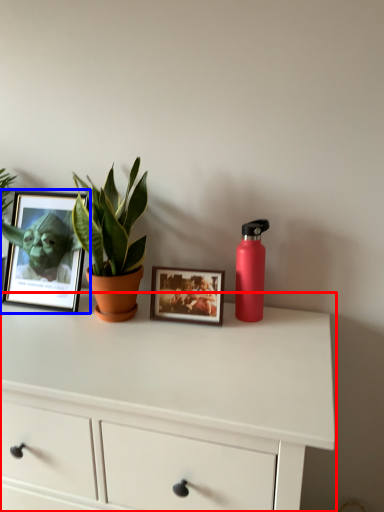
Question: Which object appears closest to the camera in this image, chest of drawers (highlighted by a red box) or picture frame (highlighted by a blue box)?

Choices:
 (A) chest of drawers
 (B) picture frame

Answer: (A)